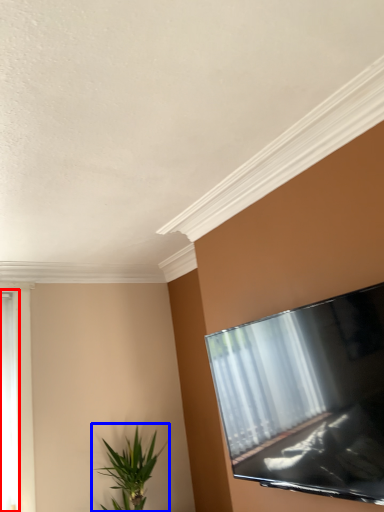
Question: Which object is closer to the camera taking this photo, window (highlighted by a red box) or houseplant (highlighted by a blue box)?

Choices:
 (A) window
 (B) houseplant

Answer: (B)